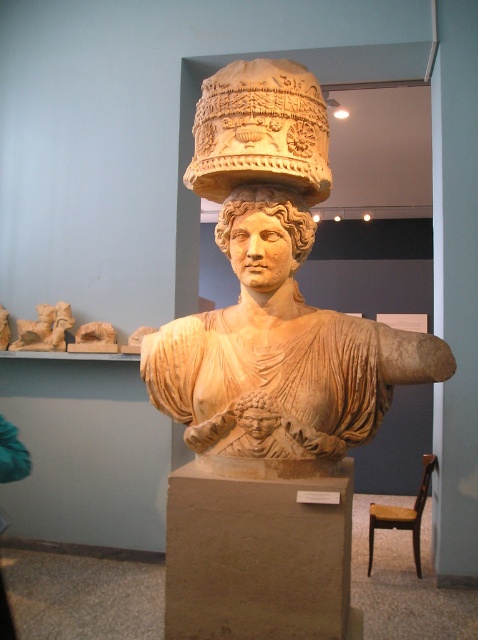
Who is taller, matte beige head at center or matte stone head at center?

With more height is matte beige head at center.

Can you confirm if matte beige head at center is thinner than matte stone head at center?

In fact, matte beige head at center might be wider than matte stone head at center.

Is point (304, 208) in front of point (273, 424)?

No, (304, 208) is behind (273, 424).

At what (x,y) coordinates should I click in order to perform the action: click on matte beige head at center. Please return your answer as a coordinate pair (x, y). Image resolution: width=478 pixels, height=640 pixels. Looking at the image, I should click on (270, 216).

Between beige stone bust at center and matte beige head at center, which one is positioned lower?

beige stone bust at center is below.

How distant is beige stone bust at center from matte beige head at center?

The distance of beige stone bust at center from matte beige head at center is 26.14 centimeters.

Between point (243, 148) and point (225, 205), which one is positioned in front?

Positioned in front is point (243, 148).

Find the location of a particular element. The height and width of the screenshot is (640, 478). beige stone bust at center is located at coordinates (269, 378).

Measure the distance between beige stone pedestal at center and camera.

A distance of 5.42 feet exists between beige stone pedestal at center and camera.

Does point (178, 576) lie in front of point (239, 400)?

No, it is behind (239, 400).

You are a GUI agent. You are given a task and a screenshot of the screen. Output one action in this format:
    pyautogui.click(x=<x>, y=<y>)
    Task: Click on the beige stone pedestal at center
    The height and width of the screenshot is (640, 478).
    Given the screenshot: What is the action you would take?
    pyautogui.click(x=259, y=556)